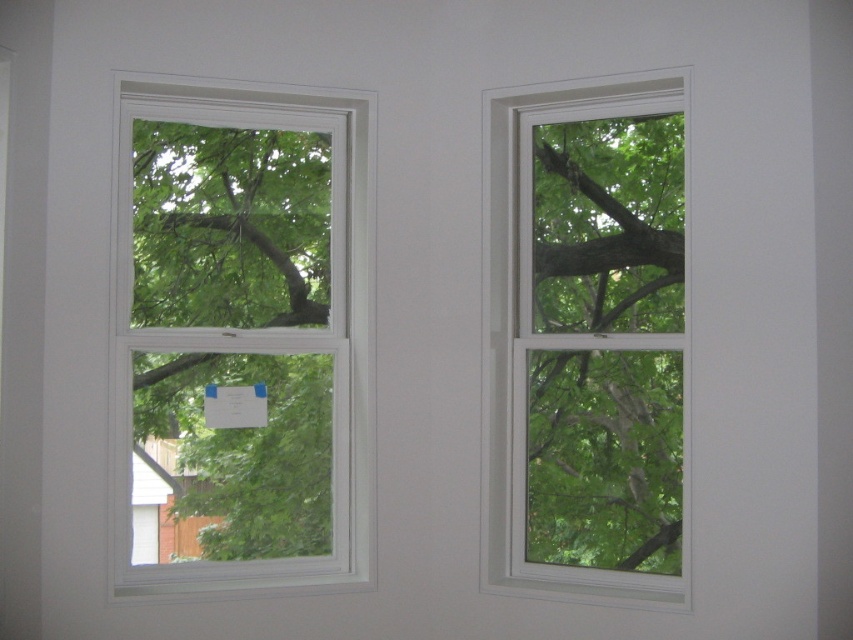
Question: Which point is farther from the camera taking this photo?

Choices:
 (A) (195, 540)
 (B) (561, 582)

Answer: (B)

Question: Among these points, which one is nearest to the camera?

Choices:
 (A) (614, 513)
 (B) (300, 346)

Answer: (A)

Question: Does white plastic window at left have a larger size compared to white plastic window at center?

Choices:
 (A) yes
 (B) no

Answer: (A)

Question: Is white plastic window at left above white plastic window at center?

Choices:
 (A) no
 (B) yes

Answer: (B)

Question: Observing the image, what is the correct spatial positioning of white plastic window at left in reference to white plastic window at center?

Choices:
 (A) left
 (B) right

Answer: (A)